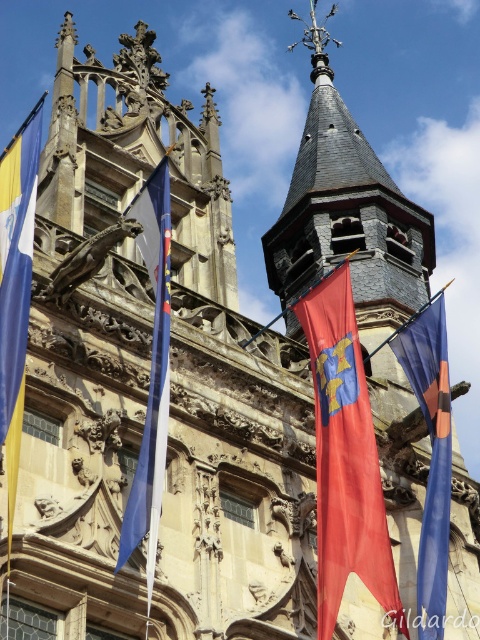
Does red fabric flag at center come in front of blue fabric flag at center?

No, red fabric flag at center is behind blue fabric flag at center.

Which is above, red fabric flag at center or blue fabric flag at center?

blue fabric flag at center is above.

Where is `red fabric flag at center`? Image resolution: width=480 pixels, height=640 pixels. red fabric flag at center is located at coordinates (345, 456).

The image size is (480, 640). I want to click on red fabric flag at center, so click(345, 456).

Who is positioned more to the left, blue fabric flag at right or blue fabric flag at center?

blue fabric flag at center

Is point (411, 316) positioned before point (156, 502)?

No, (411, 316) is further to viewer.

You are a GUI agent. You are given a task and a screenshot of the screen. Output one action in this format:
    pyautogui.click(x=<x>, y=<y>)
    Task: Click on the blue fabric flag at right
    
    Given the screenshot: What is the action you would take?
    pyautogui.click(x=431, y=456)

The image size is (480, 640). Find the location of `blue fabric flag at right`. blue fabric flag at right is located at coordinates (431, 456).

Consider the image. Does blue fabric flag at right have a larger size compared to yellowmatteflag at left?

Actually, blue fabric flag at right might be smaller than yellowmatteflag at left.

Which is more to the right, blue fabric flag at right or yellowmatteflag at left?

blue fabric flag at right is more to the right.

Which is in front, point (446, 372) or point (2, 264)?

Point (2, 264)

Identify the location of blue fabric flag at right. This screenshot has width=480, height=640. (431, 456).